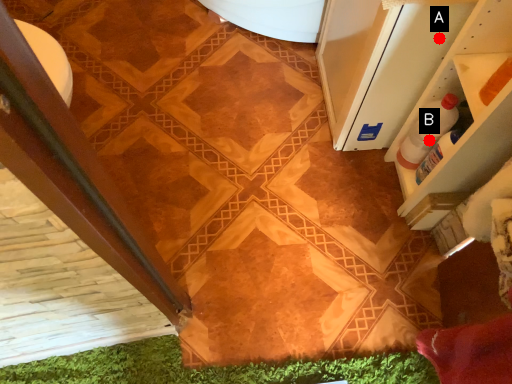
Question: Two points are circled on the image, labeled by A and B beside each circle. Which point is closer to the camera taking this photo?

Choices:
 (A) A is closer
 (B) B is closer

Answer: (A)